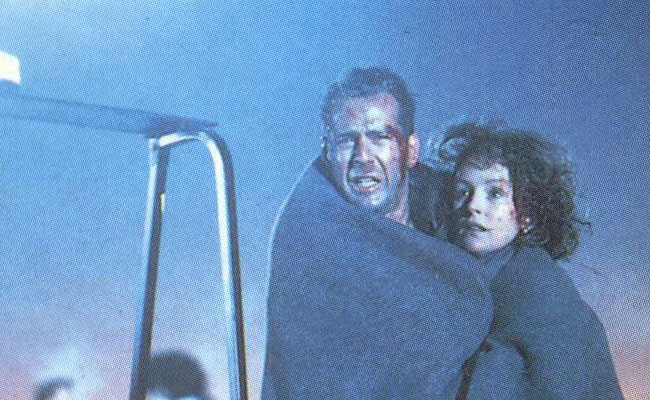
This screenshot has height=400, width=650. Identify the location of blanket. click(x=309, y=200), click(x=409, y=324), click(x=495, y=356), click(x=556, y=354).